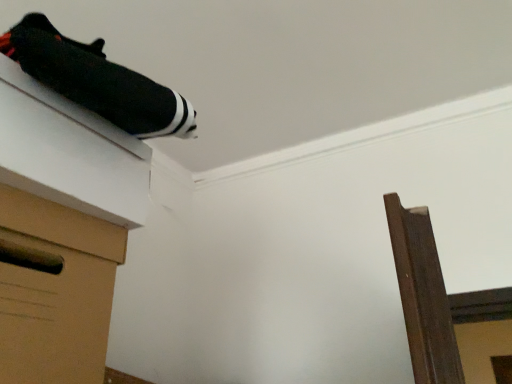
The width and height of the screenshot is (512, 384). Describe the element at coordinates (63, 227) in the screenshot. I see `black fabric at upper left` at that location.

At what (x,y) coordinates should I click in order to perform the action: click on black fabric shoe at upper left. Please return your answer as a coordinate pair (x, y). The image size is (512, 384). Looking at the image, I should click on (98, 81).

From a real-world perspective, relative to black fabric at upper left, is black fabric shoe at upper left vertically above or below?

In terms of real-world spatial position, black fabric shoe at upper left is above black fabric at upper left.

In the scene shown: Which is nearer, (179, 124) or (48, 288)?

Point (179, 124).

Is black fabric shoe at upper left turned away from black fabric at upper left?

That's not correct — black fabric shoe at upper left is not looking away from black fabric at upper left.

Is the position of brown cardboard drawer at lower left less distant than that of black fabric at upper left?

Yes, it is in front of black fabric at upper left.

Which object is wider, brown cardboard drawer at lower left or black fabric at upper left?

With larger width is brown cardboard drawer at lower left.

From the picture: Is brown cardboard drawer at lower left oriented towards black fabric at upper left?

No, brown cardboard drawer at lower left is not facing towards black fabric at upper left.

Is point (62, 172) positioned behind point (27, 279)?

Yes, it is.

From a real-world perspective, which is physically above, black fabric at upper left or brown cardboard drawer at lower left?

From a 3D spatial view, black fabric at upper left is above.

Based on the photo, is black fabric at upper left not within brown cardboard drawer at lower left?

Yes.

How different are the orientations of black fabric at upper left and brown cardboard drawer at lower left in degrees?

2.44 degrees.

Is black fabric at upper left oriented away from black fabric shoe at upper left?

No.

Is black fabric at upper left far away from black fabric shoe at upper left?

They are positioned close to each other.

Considering the sizes of objects black fabric at upper left and black fabric shoe at upper left in the image provided, who is wider, black fabric at upper left or black fabric shoe at upper left?

With larger width is black fabric at upper left.

Between black fabric at upper left and black fabric shoe at upper left, which one has smaller size?

black fabric shoe at upper left.

Where is `twin on the right of brown cardboard drawer at lower left`? twin on the right of brown cardboard drawer at lower left is located at coordinates (98, 81).

Which of these two, black fabric shoe at upper left or brown cardboard drawer at lower left, is smaller?

black fabric shoe at upper left.

Based on the photo, from a real-world perspective, does black fabric shoe at upper left sit lower than brown cardboard drawer at lower left?

Incorrect, from a real-world perspective, black fabric shoe at upper left is higher than brown cardboard drawer at lower left.

From the image's perspective, is black fabric shoe at upper left under brown cardboard drawer at lower left?

No, from the image's perspective, black fabric shoe at upper left is not below brown cardboard drawer at lower left.

Is brown cardboard drawer at lower left turned away from black fabric shoe at upper left?

brown cardboard drawer at lower left is not turned away from black fabric shoe at upper left.

From the image's perspective, would you say brown cardboard drawer at lower left is shown under black fabric shoe at upper left?

Yes, from the image's perspective, brown cardboard drawer at lower left is below black fabric shoe at upper left.

From a real-world perspective, is brown cardboard drawer at lower left beneath black fabric shoe at upper left?

Yes.

Where is `vanity that is on the left side of black fabric shoe at upper left`? The image size is (512, 384). vanity that is on the left side of black fabric shoe at upper left is located at coordinates (63, 227).

The image size is (512, 384). What are the coordinates of `vanity that appears above the brown cardboard drawer at lower left (from the image's perspective)` in the screenshot? It's located at (63, 227).

Estimate the real-world distances between objects in this image. Which object is further from black fabric at upper left, black fabric shoe at upper left or brown cardboard drawer at lower left?

black fabric shoe at upper left is further to black fabric at upper left.

Looking at the image, which one is located further to black fabric shoe at upper left, brown cardboard drawer at lower left or black fabric at upper left?

Among the two, brown cardboard drawer at lower left is located further to black fabric shoe at upper left.

Estimate the real-world distances between objects in this image. Which object is further from brown cardboard drawer at lower left, black fabric shoe at upper left or black fabric at upper left?

black fabric shoe at upper left lies further to brown cardboard drawer at lower left than the other object.

Considering their positions, is black fabric at upper left positioned closer to black fabric shoe at upper left than brown cardboard drawer at lower left?

black fabric at upper left is closer to black fabric shoe at upper left.

When comparing their distances from black fabric at upper left, does brown cardboard drawer at lower left or black fabric shoe at upper left seem further?

black fabric shoe at upper left.

Based on their spatial positions, is black fabric at upper left or black fabric shoe at upper left further from brown cardboard drawer at lower left?

The object further to brown cardboard drawer at lower left is black fabric shoe at upper left.

Where is `vanity between black fabric shoe at upper left and brown cardboard drawer at lower left from top to bottom`? vanity between black fabric shoe at upper left and brown cardboard drawer at lower left from top to bottom is located at coordinates (63, 227).